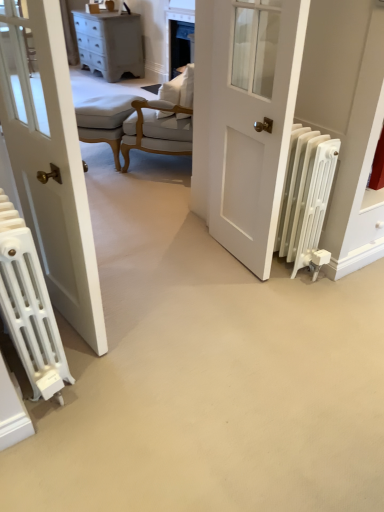
Locate an element on the screen. The image size is (384, 512). vacant space underneath white matte door at center (from a real-world perspective) is located at coordinates (228, 258).